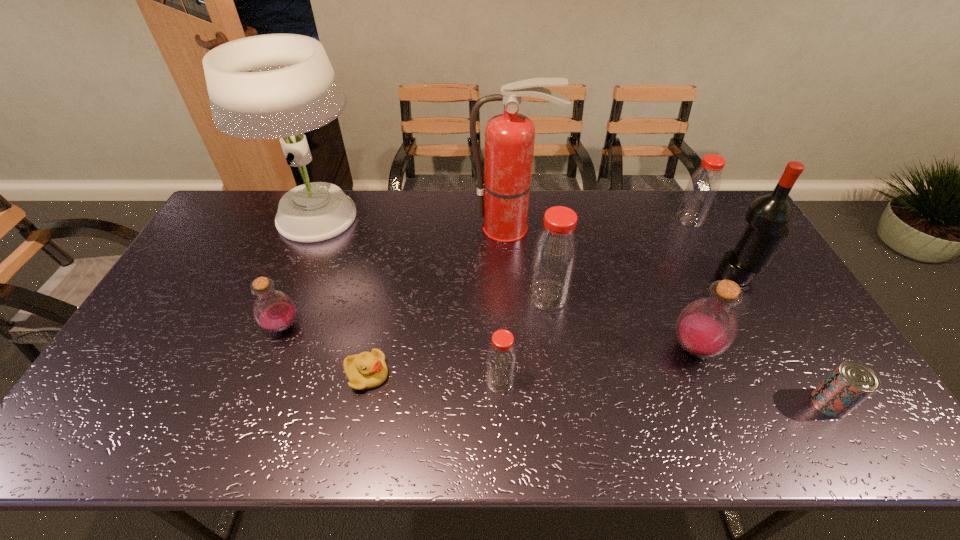
The height and width of the screenshot is (540, 960). Find the location of `bottle located at the far edge`. bottle located at the far edge is located at coordinates [703, 186].

You are a GUI agent. You are given a task and a screenshot of the screen. Output one action in this format:
    pyautogui.click(x=<x>, y=<y>)
    Task: Click on the object that is at the near edge
    The image size is (960, 540).
    Given the screenshot: What is the action you would take?
    pyautogui.click(x=850, y=383)

Find the location of a particular element. wine bottle that is at the right edge is located at coordinates (767, 216).

At what (x,y) coordinates should I click in order to perform the action: click on bottle located in the right edge section of the desktop. Please return your answer as a coordinate pair (x, y). The width and height of the screenshot is (960, 540). Looking at the image, I should click on (703, 186).

Where is `beer can situated at the right edge`? This screenshot has height=540, width=960. beer can situated at the right edge is located at coordinates (850, 383).

Find the location of a particular element. This screenshot has width=960, height=540. object that is positioned at the far right corner is located at coordinates (703, 186).

This screenshot has width=960, height=540. In order to click on object that is at the near right corner in this screenshot , I will do `click(850, 383)`.

This screenshot has height=540, width=960. What are the coordinates of `vacant region at the far edge of the desktop` in the screenshot? It's located at (663, 202).

Identify the location of vacant space at the near edge of the desktop. (514, 417).

Locate an element on the screen. vacant space at the left edge of the desktop is located at coordinates (192, 320).